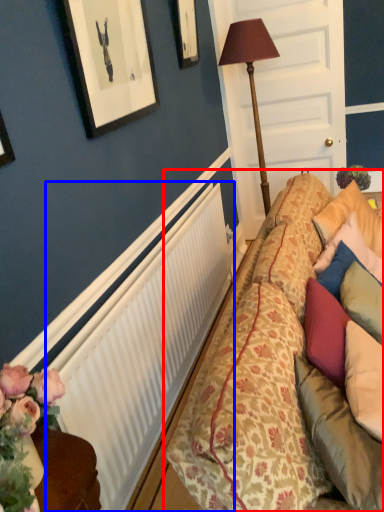
Question: Among these objects, which one is nearest to the camera, studio couch (highlighted by a red box) or radiator (highlighted by a blue box)?

Choices:
 (A) studio couch
 (B) radiator

Answer: (A)